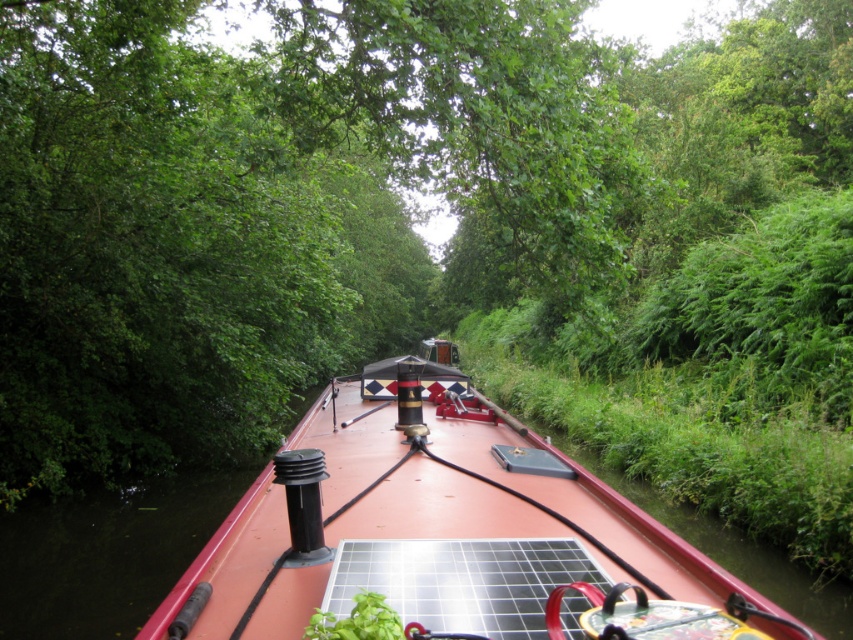
You are a photographer planning to capture the red matte boat at center and the black solar panel at center in the same frame. Based on their sizes, which object should you focus on first to ensure both are in clear view?

The red matte boat at center is much taller than the black solar panel at center, so you should focus on the red matte boat at center first to ensure both are in clear view.

You are navigating a narrowboat and need to position a new solar panel on the deck. The current deck has the red matte boat at center and the black solar panel at center. Which object is positioned to the right when viewed from the front of the boat?

The black solar panel at center is positioned to the right of the red matte boat at center.